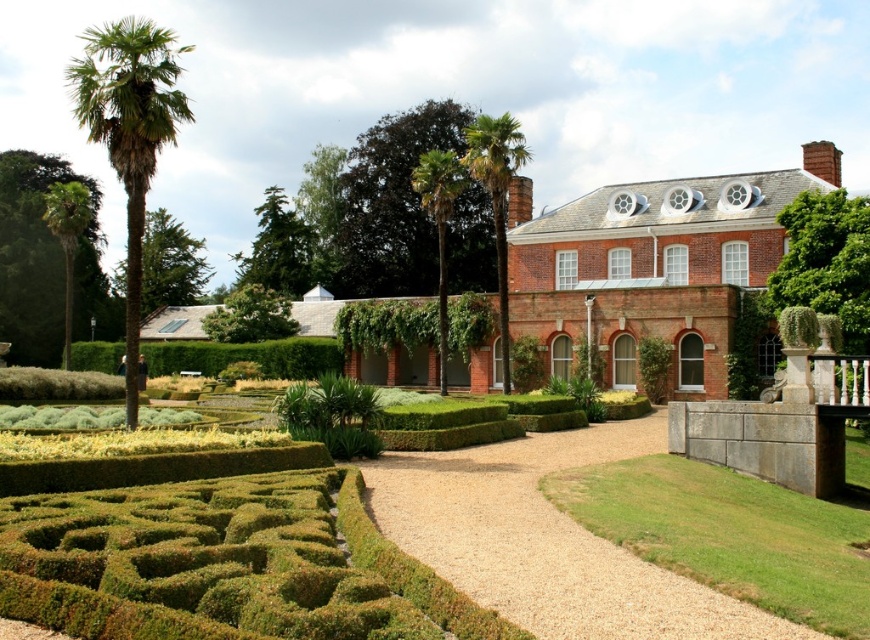
You are standing in the garden and want to walk from the green leafy palm at left to the green leafy hedge at center. Which direction should you move?

You should move to the right because the green leafy palm at left is to the left of the green leafy hedge at center, so moving right will take you towards it.

Consider the image. You are standing in the garden and want to walk towards the brick building. There are two points marked on the path. Which point, point (410,499) or point (505,250), is closer to you as you face the building?

Point (410,499) is closer to you because it is closer to the viewer than point (505,250).